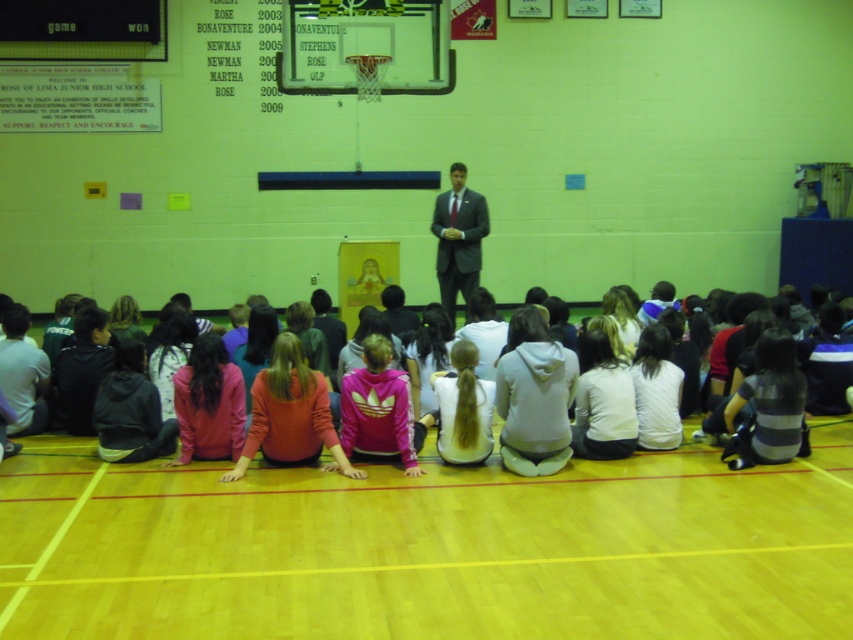
Is solid white jersey at center positioned behind matte gray suit at center?

No, solid white jersey at center is closer to the viewer.

Does point (624, 513) come closer to viewer compared to point (444, 289)?

Yes, point (624, 513) is in front of point (444, 289).

This screenshot has height=640, width=853. In order to click on solid white jersey at center in this screenshot , I will do `click(434, 484)`.

Is solid white jersey at center below white hoodie at center?

Indeed, solid white jersey at center is positioned under white hoodie at center.

The height and width of the screenshot is (640, 853). What do you see at coordinates (434, 484) in the screenshot?
I see `solid white jersey at center` at bounding box center [434, 484].

Is point (476, 481) more distant than point (491, 440)?

No, it is in front of (491, 440).

At what (x,y) coordinates should I click in order to perform the action: click on solid white jersey at center. Please return your answer as a coordinate pair (x, y). Looking at the image, I should click on (434, 484).

Can you confirm if white hoodie at center is positioned above matte gray suit at center?

Incorrect, white hoodie at center is not positioned above matte gray suit at center.

Between white hoodie at center and matte gray suit at center, which one is positioned lower?

white hoodie at center is lower down.

Is point (442, 435) closer to viewer compared to point (457, 224)?

Yes.

The image size is (853, 640). I want to click on white hoodie at center, so click(x=463, y=406).